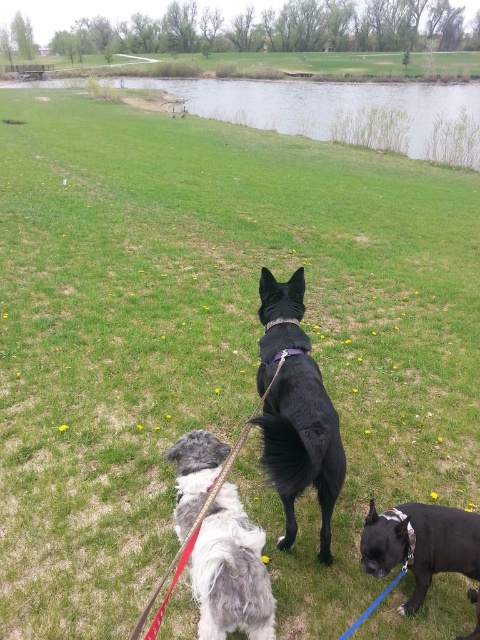
Does fluffy gray fur at center appear on the right side of shiny black dog at lower right?

No, fluffy gray fur at center is not to the right of shiny black dog at lower right.

Who is lower down, fluffy gray fur at center or shiny black dog at lower right?

Positioned lower is shiny black dog at lower right.

Is point (216, 636) in front of point (421, 540)?

Yes, it is in front of point (421, 540).

Find the location of a particular element. The image size is (480, 640). fluffy gray fur at center is located at coordinates pyautogui.click(x=230, y=572).

Measure the distance between green grassy bank at upper center and camera.

A distance of 78.75 feet exists between green grassy bank at upper center and camera.

Does green grassy bank at upper center appear under black smooth fur dog at center?

No, green grassy bank at upper center is not below black smooth fur dog at center.

The width and height of the screenshot is (480, 640). Identify the location of green grassy bank at upper center. (342, 112).

Can you confirm if green grassy bank at upper center is taller than leather rope leash at center?

Yes, green grassy bank at upper center is taller than leather rope leash at center.

Does point (327, 108) come farther from viewer compared to point (145, 609)?

Yes, it is behind point (145, 609).

At what (x,y) coordinates should I click in order to perform the action: click on green grassy bank at upper center. Please return your answer as a coordinate pair (x, y). This screenshot has height=640, width=480. Looking at the image, I should click on (342, 112).